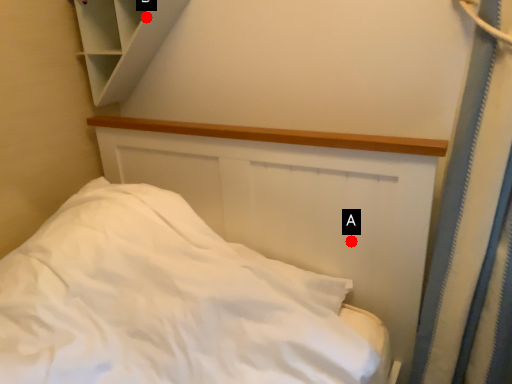
Question: Two points are circled on the image, labeled by A and B beside each circle. Which point is farther from the camera taking this photo?

Choices:
 (A) A is further
 (B) B is further

Answer: (B)